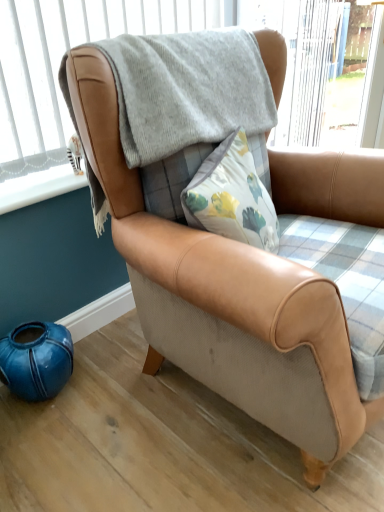
Question: Based on their positions, is plaid fabric window frame at upper center located to the left or right of white plastic window sill at lower left?

Choices:
 (A) left
 (B) right

Answer: (B)

Question: Looking at their shapes, would you say plaid fabric window frame at upper center is wider or thinner than white plastic window sill at lower left?

Choices:
 (A) wide
 (B) thin

Answer: (A)

Question: Is plaid fabric window frame at upper center inside or outside of white plastic window sill at lower left?

Choices:
 (A) outside
 (B) inside

Answer: (A)

Question: Considering the relative positions of white plastic window sill at lower left and plaid fabric window frame at upper center in the image provided, is white plastic window sill at lower left to the left or to the right of plaid fabric window frame at upper center?

Choices:
 (A) right
 (B) left

Answer: (B)

Question: From a real-world perspective, is white plastic window sill at lower left above or below plaid fabric window frame at upper center?

Choices:
 (A) below
 (B) above

Answer: (A)

Question: Do you think white plastic window sill at lower left is within plaid fabric window frame at upper center, or outside of it?

Choices:
 (A) outside
 (B) inside

Answer: (A)

Question: In the image, is white plastic window sill at lower left positioned in front of or behind plaid fabric window frame at upper center?

Choices:
 (A) front
 (B) behind

Answer: (B)